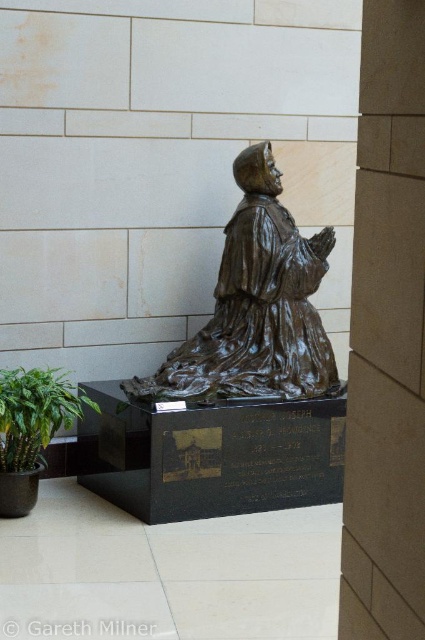
Question: Which point is closer to the camera?

Choices:
 (A) (405, 266)
 (B) (286, 276)

Answer: (A)

Question: Does brown stone pillar at center appear under bronze statue at center?

Choices:
 (A) yes
 (B) no

Answer: (A)

Question: Does brown stone pillar at center have a lesser width compared to bronze statue at center?

Choices:
 (A) yes
 (B) no

Answer: (A)

Question: Can you confirm if brown stone pillar at center is positioned to the left of bronze statue at center?

Choices:
 (A) yes
 (B) no

Answer: (B)